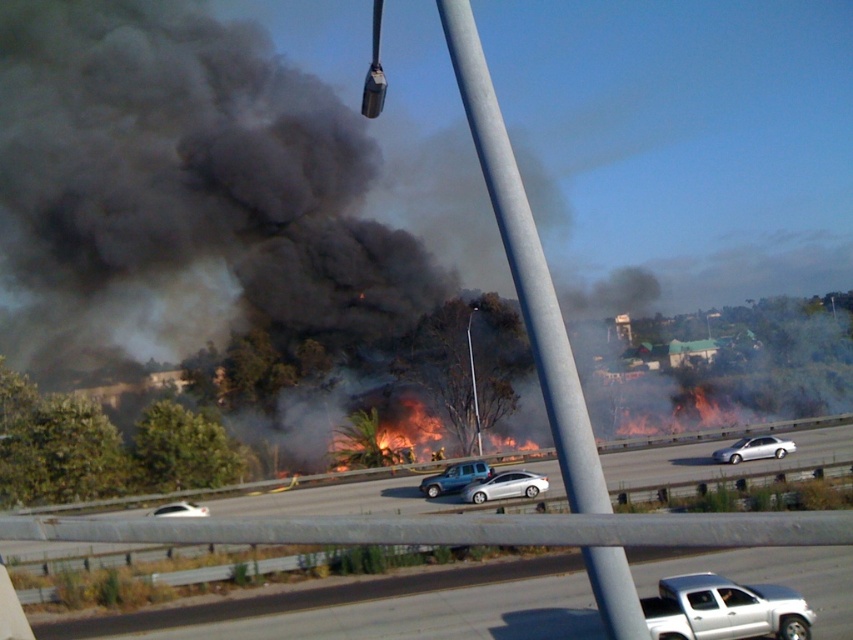
Question: Does satin silver sedan at center come behind satin silver suv at center?

Choices:
 (A) no
 (B) yes

Answer: (A)

Question: Does black smoke at center have a larger size compared to silver metallic truck at lower right?

Choices:
 (A) yes
 (B) no

Answer: (A)

Question: Which of these objects is positioned closest to the silver metallic sedan at center-right?

Choices:
 (A) satin silver suv at center
 (B) black smoke at center
 (C) smooth asphalt highway at center

Answer: (C)

Question: Does satin silver suv at center appear over silver metallic sedan at center-right?

Choices:
 (A) no
 (B) yes

Answer: (A)

Question: Which of the following is the closest to the observer?

Choices:
 (A) silver metallic sedan at center-right
 (B) satin silver sedan at center

Answer: (B)

Question: Which of the following is the farthest from the observer?

Choices:
 (A) black smoke at center
 (B) smooth asphalt highway at center

Answer: (B)